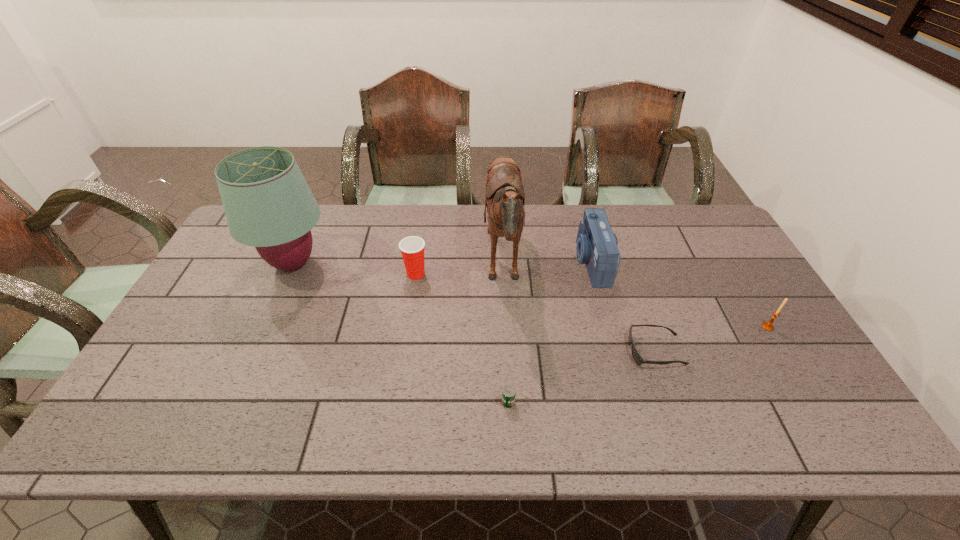
Locate an element on the screen. The width and height of the screenshot is (960, 540). free space that satisfies the following two spatial constraints: 1. on the front side of the leftmost object; 2. on the left side of the Dixie cup is located at coordinates 288,274.

Identify the location of free location that satisfies the following two spatial constraints: 1. on the back of the saddle; 2. on the back side of the third nearest object. (506, 327).